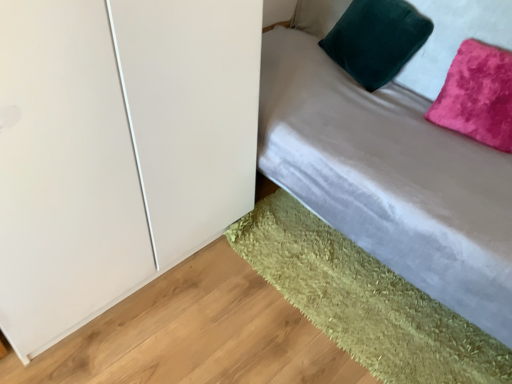
Question: Is velvet gray bed at upper right turned away from pink velvet pillow at upper right, which is counted as the first pillow, starting from the right?

Choices:
 (A) yes
 (B) no

Answer: (A)

Question: Is velvet gray bed at upper right to the left of pink velvet pillow at upper right, which is counted as the first pillow, starting from the right, from the viewer's perspective?

Choices:
 (A) yes
 (B) no

Answer: (A)

Question: Is velvet gray bed at upper right shorter than pink velvet pillow at upper right, which is counted as the first pillow, starting from the right?

Choices:
 (A) yes
 (B) no

Answer: (B)

Question: Is pink velvet pillow at upper right, positioned as the 2th pillow in left-to-right order, surrounded by velvet gray bed at upper right?

Choices:
 (A) yes
 (B) no

Answer: (A)

Question: Is velvet gray bed at upper right far from pink velvet pillow at upper right, which is counted as the first pillow, starting from the right?

Choices:
 (A) no
 (B) yes

Answer: (A)

Question: From a real-world perspective, is pink velvet pillow at upper right, positioned as the 2th pillow in left-to-right order, physically located above or below green shaggy rug at lower right?

Choices:
 (A) below
 (B) above

Answer: (B)

Question: In the image, is pink velvet pillow at upper right, which is counted as the first pillow, starting from the right, on the left side or the right side of green shaggy rug at lower right?

Choices:
 (A) left
 (B) right

Answer: (B)

Question: Is pink velvet pillow at upper right, which is counted as the first pillow, starting from the right, spatially inside green shaggy rug at lower right, or outside of it?

Choices:
 (A) outside
 (B) inside

Answer: (A)

Question: Is pink velvet pillow at upper right, which is counted as the first pillow, starting from the right, bigger or smaller than green shaggy rug at lower right?

Choices:
 (A) small
 (B) big

Answer: (B)

Question: Would you say green shaggy rug at lower right is to the left or to the right of velvet green pillow at upper right, the 1th pillow viewed from the left, in the picture?

Choices:
 (A) left
 (B) right

Answer: (A)

Question: In terms of height, does green shaggy rug at lower right look taller or shorter compared to velvet green pillow at upper right, the 1th pillow viewed from the left?

Choices:
 (A) tall
 (B) short

Answer: (B)

Question: Do you think green shaggy rug at lower right is within velvet green pillow at upper right, the 2th pillow when ordered from right to left, or outside of it?

Choices:
 (A) inside
 (B) outside

Answer: (B)

Question: From the image's perspective, is green shaggy rug at lower right positioned above or below velvet green pillow at upper right, the 2th pillow when ordered from right to left?

Choices:
 (A) above
 (B) below

Answer: (B)

Question: Which is correct: velvet gray bed at upper right is inside velvet green pillow at upper right, the 2th pillow when ordered from right to left, or outside of it?

Choices:
 (A) inside
 (B) outside

Answer: (B)

Question: From the image's perspective, is velvet gray bed at upper right located above or below velvet green pillow at upper right, the 2th pillow when ordered from right to left?

Choices:
 (A) above
 (B) below

Answer: (B)